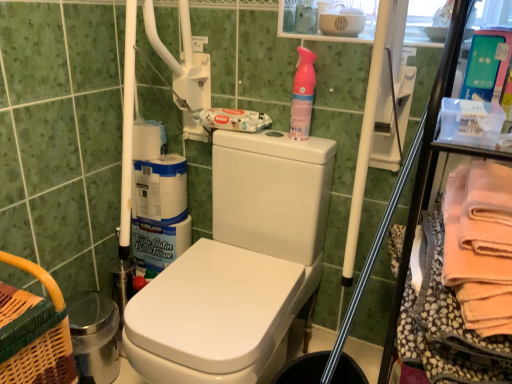
At what (x,y) coordinates should I click in order to perform the action: click on free location in front of pink plastic spray bottle at upper right. Please return your answer as a coordinate pair (x, y). Looking at the image, I should click on (303, 144).